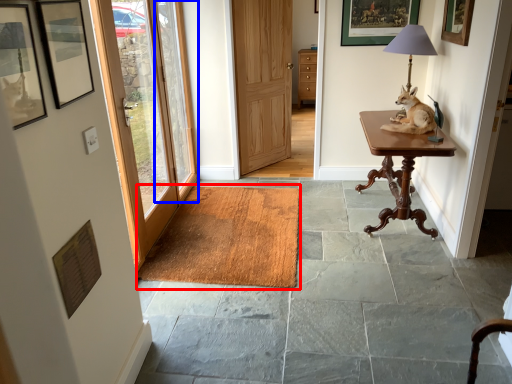
Question: Which point is further to the camera, doormat (highlighted by a red box) or window (highlighted by a blue box)?

Choices:
 (A) doormat
 (B) window

Answer: (B)